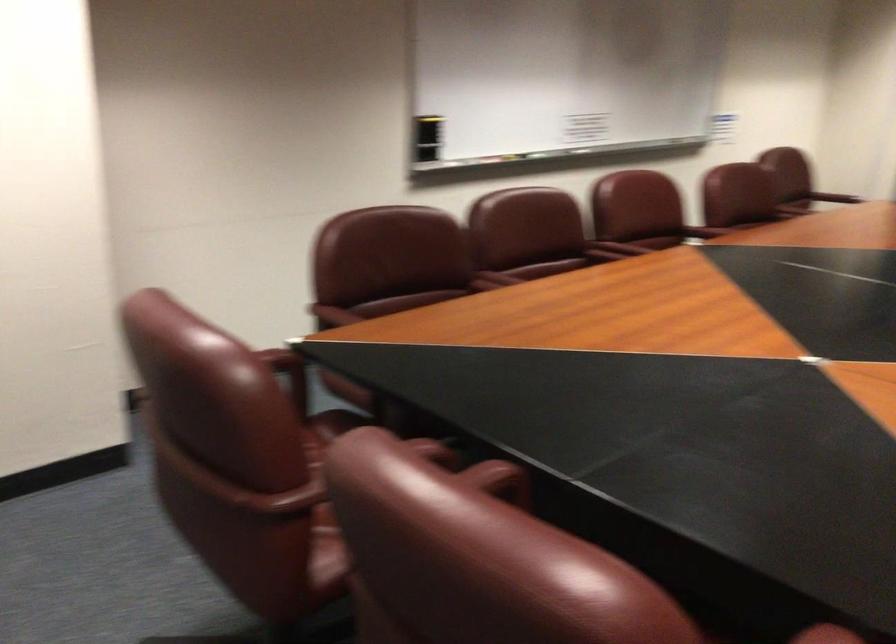
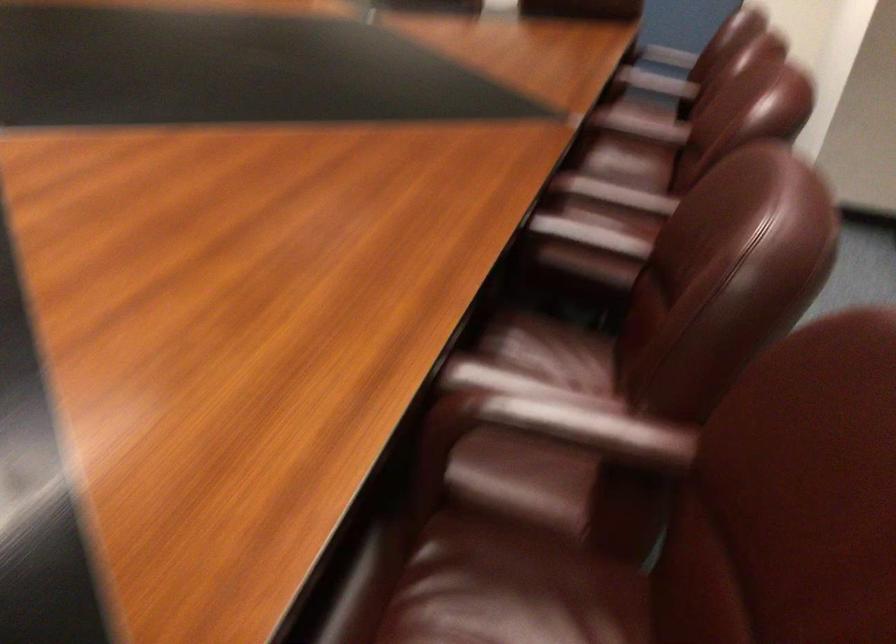
Find the pixel in the second image that matches the point at 743,220 in the first image.

(590, 247)